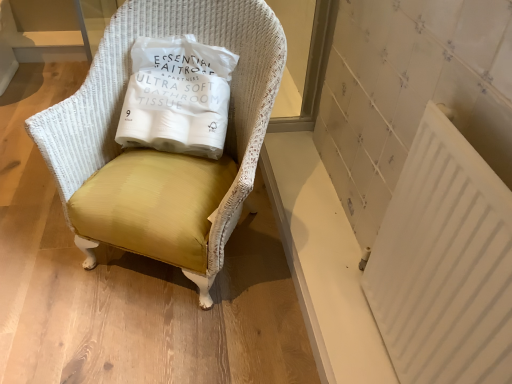
What do you see at coordinates (177, 96) in the screenshot? This screenshot has height=384, width=512. I see `white paper bag at center` at bounding box center [177, 96].

Image resolution: width=512 pixels, height=384 pixels. In order to click on matte yellow fabric chair at center in this screenshot , I will do `click(157, 152)`.

Describe the element at coordinates (444, 263) in the screenshot. I see `white plastic radiator at lower right` at that location.

At what (x,y) coordinates should I click in order to perform the action: click on white paper bag at center. Please return your answer as a coordinate pair (x, y). This screenshot has height=384, width=512. Looking at the image, I should click on (177, 96).

Between point (85, 231) and point (211, 59), which one is positioned behind?

Point (211, 59)

Is matte yellow fabric chair at center inside the boundaries of white paper bag at center, or outside?

matte yellow fabric chair at center is spatially situated outside white paper bag at center.

From the image's perspective, does matte yellow fabric chair at center appear lower than white paper bag at center?

Yes, from the image's perspective, matte yellow fabric chair at center is below white paper bag at center.

What's the angular difference between white plastic radiator at lower right and white paper bag at center's facing directions?

There is a 75.5-degree angle between the facing directions of white plastic radiator at lower right and white paper bag at center.

Is white plastic radiator at lower right aimed at white paper bag at center?

No, white plastic radiator at lower right is not facing towards white paper bag at center.

Between white plastic radiator at lower right and white paper bag at center, which one is positioned behind?

white paper bag at center is more distant.

Considering the positions of points (437, 355) and (216, 121), is point (437, 355) farther from camera compared to point (216, 121)?

No, it is in front of (216, 121).

Is white paper bag at center smaller than matte yellow fabric chair at center?

Yes.

This screenshot has height=384, width=512. Find the location of `chair on the left of white paper bag at center`. chair on the left of white paper bag at center is located at coordinates (157, 152).

Is white paper bag at center outside of matte yellow fabric chair at center?

No, white paper bag at center is inside matte yellow fabric chair at center's boundary.

Looking at their sizes, would you say white paper bag at center is wider or thinner than matte yellow fabric chair at center?

In the image, white paper bag at center appears to be more narrow than matte yellow fabric chair at center.

This screenshot has height=384, width=512. In the image, there is a white plastic radiator at lower right. Find the location of `chair above it (from the image's perspective)`. chair above it (from the image's perspective) is located at coordinates (157, 152).

In the scene shown: Is white plastic radiator at lower right to the left of matte yellow fabric chair at center from the viewer's perspective?

Incorrect, white plastic radiator at lower right is not on the left side of matte yellow fabric chair at center.

Are white plastic radiator at lower right and matte yellow fabric chair at center far apart?

That's not correct — white plastic radiator at lower right is a little close to matte yellow fabric chair at center.

From the image's perspective, is white plastic radiator at lower right under matte yellow fabric chair at center?

Correct, white plastic radiator at lower right appears lower than matte yellow fabric chair at center in the image.

From the image's perspective, is white paper bag at center on white plastic radiator at lower right?

Indeed, from the image's perspective, white paper bag at center is shown above white plastic radiator at lower right.

Between white paper bag at center and white plastic radiator at lower right, which one has smaller size?

With smaller size is white plastic radiator at lower right.

Locate an element on the screen. The width and height of the screenshot is (512, 384). radiator on the right of white paper bag at center is located at coordinates (444, 263).

Is white paper bag at center placed right next to white plastic radiator at lower right?

No, white paper bag at center is not touching white plastic radiator at lower right.

Does matte yellow fabric chair at center have a greater height compared to white plastic radiator at lower right?

Yes, matte yellow fabric chair at center is taller than white plastic radiator at lower right.

Relative to white plastic radiator at lower right, is matte yellow fabric chair at center in front or behind?

In the image, matte yellow fabric chair at center appears behind white plastic radiator at lower right.

Which object is wider, matte yellow fabric chair at center or white plastic radiator at lower right?

matte yellow fabric chair at center.

Is matte yellow fabric chair at center looking in the opposite direction of white plastic radiator at lower right?

No, matte yellow fabric chair at center is not facing the opposite direction of white plastic radiator at lower right.

Where is `pillow above the matte yellow fabric chair at center (from the image's perspective)`? This screenshot has width=512, height=384. pillow above the matte yellow fabric chair at center (from the image's perspective) is located at coordinates (177, 96).

The height and width of the screenshot is (384, 512). I want to click on pillow on the left side of white plastic radiator at lower right, so click(x=177, y=96).

Considering their positions, is white paper bag at center positioned closer to white plastic radiator at lower right than matte yellow fabric chair at center?

The object closer to white plastic radiator at lower right is matte yellow fabric chair at center.

Looking at the image, which one is located further to white paper bag at center, white plastic radiator at lower right or matte yellow fabric chair at center?

white plastic radiator at lower right is further to white paper bag at center.

Which object lies further to the anchor point matte yellow fabric chair at center, white paper bag at center or white plastic radiator at lower right?

white plastic radiator at lower right is further to matte yellow fabric chair at center.

Based on their spatial positions, is white plastic radiator at lower right or white paper bag at center further from matte yellow fabric chair at center?

white plastic radiator at lower right.

Estimate the real-world distances between objects in this image. Which object is closer to white paper bag at center, matte yellow fabric chair at center or white plastic radiator at lower right?

Among the two, matte yellow fabric chair at center is located nearer to white paper bag at center.

Which object lies further to the anchor point white plastic radiator at lower right, matte yellow fabric chair at center or white paper bag at center?

white paper bag at center lies further to white plastic radiator at lower right than the other object.

Find the location of a particular element. This screenshot has height=384, width=512. pillow between matte yellow fabric chair at center and white plastic radiator at lower right is located at coordinates point(177,96).